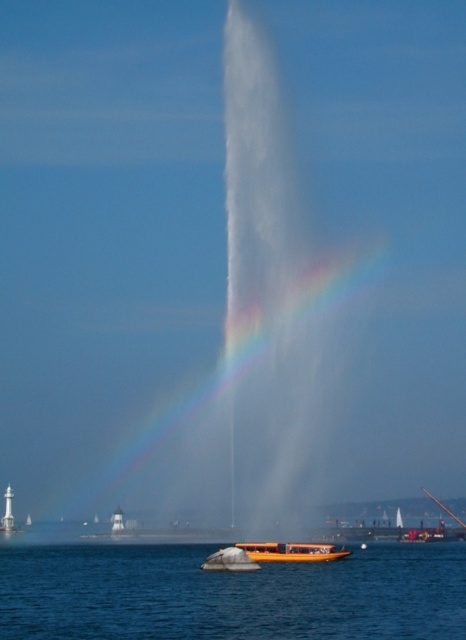
You are an architect designing a new observation deck overlooking the waterfront scene. You need to ensure visitors can see both the rainbow translucent at center and the orange polished wood boat at center clearly. Given their sizes, which object should you prioritize placing viewing spots closer to?

The orange polished wood boat at center should be prioritized for closer viewing spots since it is smaller than the rainbow translucent at center, which is larger and can be seen from a distance.

You are standing on the dock and looking at the blue water at lower center and the orange polished wood boat at center. Which object appears taller from your viewpoint?

The blue water at lower center appears taller than the orange polished wood boat at center.

You are standing on the dock and want to take a photo of the rainbow translucent at center and the blue water at lower center. Which object should you focus on first if you want both to be in sharp focus?

You should focus on the rainbow translucent at center first because it is closer to you than the blue water at lower center, which is behind it. By focusing on the closer object, the background object will also be in focus due to the depth of field.